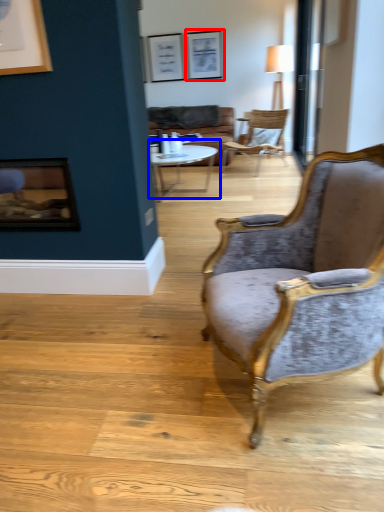
Question: Which of the following is the farthest to the observer, picture frame (highlighted by a red box) or coffee table (highlighted by a blue box)?

Choices:
 (A) picture frame
 (B) coffee table

Answer: (A)